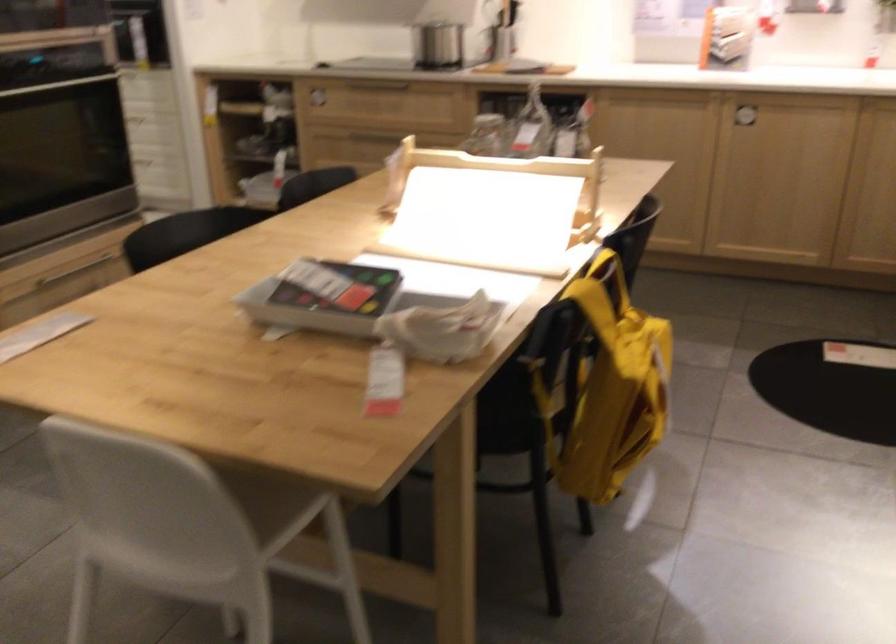
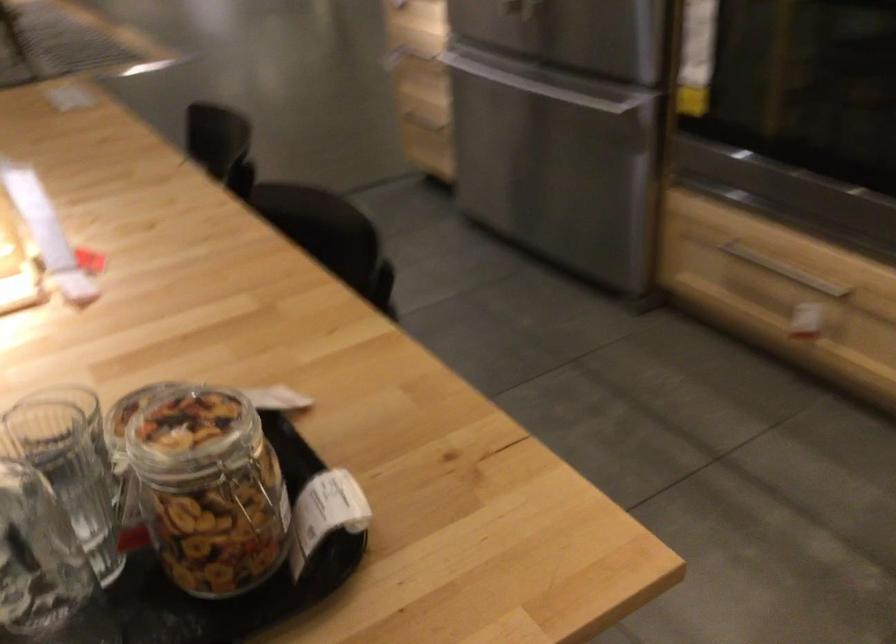
Question: I am providing you with two images of the same scene from different viewpoints. Which of the following objects are not visible in image2?

Choices:
 (A) freezer drawer handle
 (B) black tray
 (C) jar metal clasp
 (D) none of these

Answer: (D)